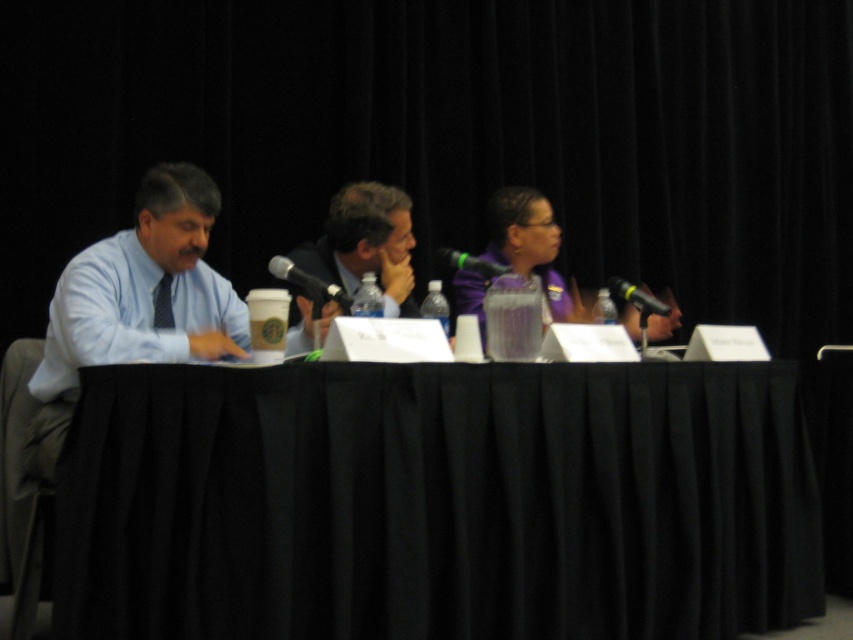
Question: Which object is the closest to the matte blue dress shirt at left?

Choices:
 (A) black fabric table at center
 (B) black plastic microphone at right
 (C) black textured tie at left

Answer: (C)

Question: Is matte blue dress shirt at left to the right of green matte microphone at center from the viewer's perspective?

Choices:
 (A) no
 (B) yes

Answer: (A)

Question: Which point is farther from the camera taking this photo?

Choices:
 (A) (624, 632)
 (B) (343, 310)
 (C) (152, 326)

Answer: (A)

Question: Does black plastic microphone at right have a greater width compared to green matte microphone at center?

Choices:
 (A) yes
 (B) no

Answer: (B)

Question: In this image, where is matte blue dress shirt at left located relative to purple fabric jacket at center?

Choices:
 (A) right
 (B) left

Answer: (B)

Question: Which object appears closest to the camera in this image?

Choices:
 (A) black textured tie at left
 (B) matte blue dress shirt at left
 (C) black plastic microphone at right

Answer: (B)